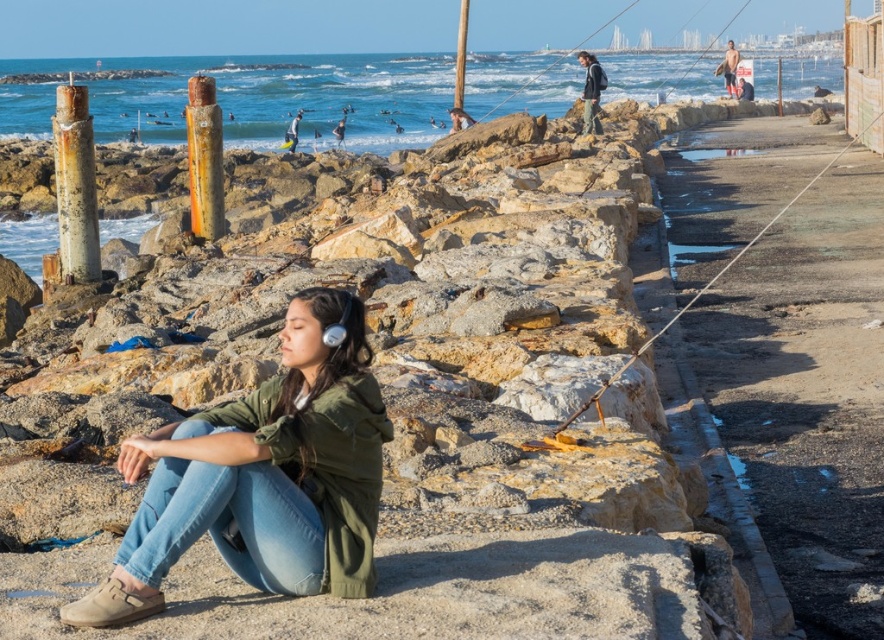
Is point (294, 516) farther from camera compared to point (310, 573)?

No, it is in front of (310, 573).

Does point (314, 392) lie in front of point (170, 500)?

That is False.

Which is behind, point (325, 515) or point (162, 566)?

Positioned behind is point (325, 515).

This screenshot has width=884, height=640. I want to click on green matte jacket at center, so click(x=263, y=476).

Who is positioned more to the left, rusty metal pole at upper left or dark gray jacket at upper center?

rusty metal pole at upper left is more to the left.

Can you confirm if rusty metal pole at upper left is thinner than dark gray jacket at upper center?

In fact, rusty metal pole at upper left might be wider than dark gray jacket at upper center.

Is point (216, 179) behind point (587, 58)?

No.

Identify the location of rusty metal pole at upper left. (204, 157).

Who is taller, dark gray jacket at upper center or tan skin surfer at upper right?

With more height is tan skin surfer at upper right.

Can you confirm if dark gray jacket at upper center is positioned below tan skin surfer at upper right?

Correct, dark gray jacket at upper center is located below tan skin surfer at upper right.

Does point (592, 86) come farther from viewer compared to point (733, 97)?

No, (592, 86) is closer to viewer.

Locate an element on the screen. The image size is (884, 640). dark gray jacket at upper center is located at coordinates (591, 92).